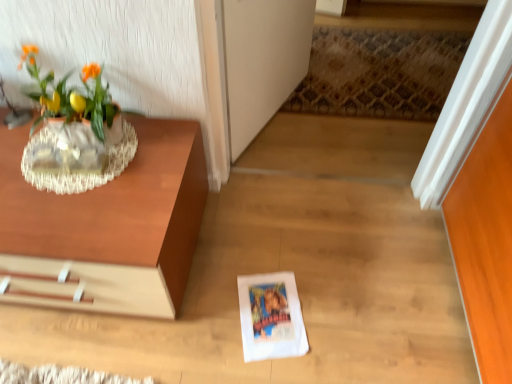
This screenshot has height=384, width=512. In order to click on vacant space in transparent glass door at center (from a real-world perspective) in this screenshot , I will do `click(281, 119)`.